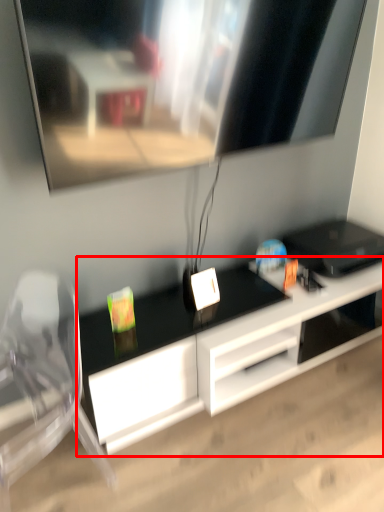
Question: From the image's perspective, where is desk (annotated by the red box) located in relation to swivel chair in the image?

Choices:
 (A) above
 (B) below

Answer: (A)